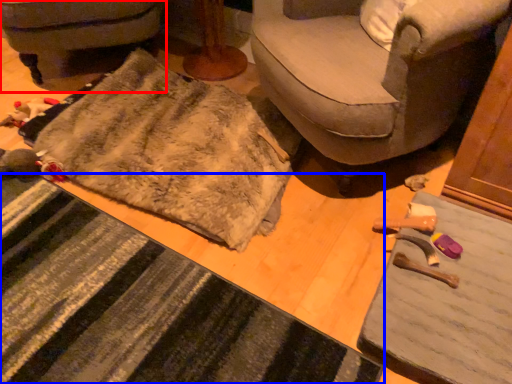
Question: Which of the following is the farthest to the observer, furniture (highlighted by a red box) or doormat (highlighted by a blue box)?

Choices:
 (A) furniture
 (B) doormat

Answer: (A)